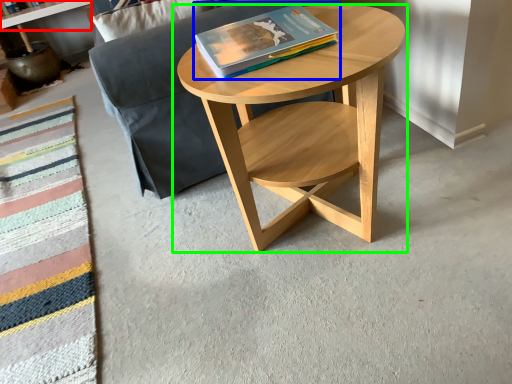
Question: Considering the real-world distances, which object is closest to shelf (highlighted by a red box)? book (highlighted by a blue box) or coffee table (highlighted by a green box).

Choices:
 (A) book
 (B) coffee table

Answer: (A)